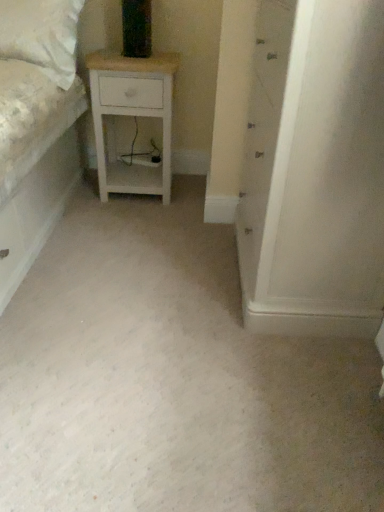
Question: Is white matte cabinet at center spatially inside white wood nightstand at center, or outside of it?

Choices:
 (A) inside
 (B) outside

Answer: (B)

Question: Looking at their shapes, would you say white matte cabinet at center is wider or thinner than white wood nightstand at center?

Choices:
 (A) thin
 (B) wide

Answer: (B)

Question: Considering the positions of white matte cabinet at center and white wood nightstand at center in the image, is white matte cabinet at center taller or shorter than white wood nightstand at center?

Choices:
 (A) short
 (B) tall

Answer: (B)

Question: From the image's perspective, is white wood nightstand at center positioned above or below white matte cabinet at center?

Choices:
 (A) above
 (B) below

Answer: (A)

Question: From a real-world perspective, is white wood nightstand at center above or below white matte cabinet at center?

Choices:
 (A) below
 (B) above

Answer: (A)

Question: Relative to white matte cabinet at center, is white wood nightstand at center in front or behind?

Choices:
 (A) behind
 (B) front

Answer: (A)

Question: Is white wood nightstand at center inside the boundaries of white matte cabinet at center, or outside?

Choices:
 (A) outside
 (B) inside

Answer: (A)